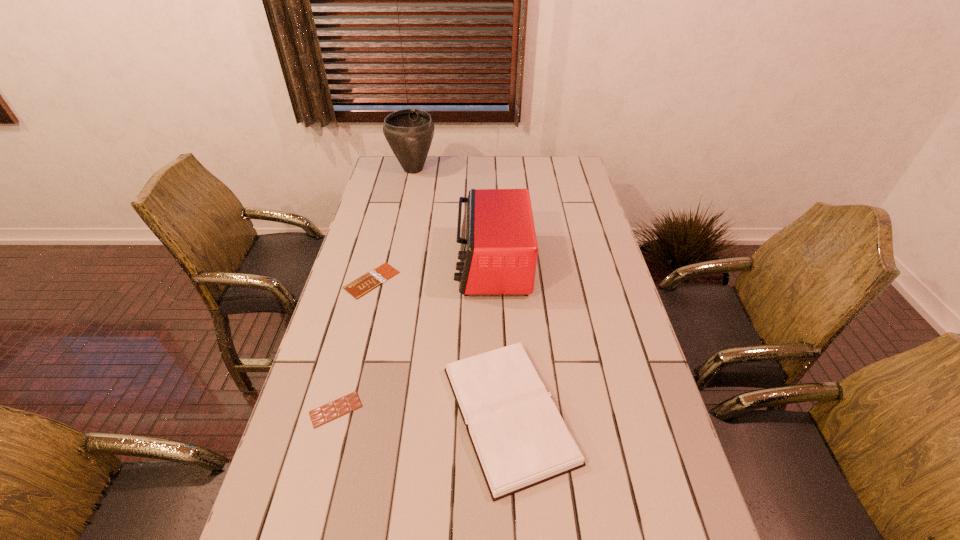
Identify the location of vacant space at the right edge of the desktop. (664, 475).

In the image, there is a desktop. Identify the location of vacant space at the far right corner. The height and width of the screenshot is (540, 960). (561, 178).

You are a GUI agent. You are given a task and a screenshot of the screen. Output one action in this format:
    pyautogui.click(x=<x>, y=<y>)
    Task: Click on the empty space between the taller chocolate bar and the third tallest object
    Image resolution: width=960 pixels, height=540 pixels.
    Given the screenshot: What is the action you would take?
    pyautogui.click(x=422, y=411)

You are a GUI agent. You are given a task and a screenshot of the screen. Output one action in this format:
    pyautogui.click(x=<x>, y=<y>)
    Task: Click on the free space between the taller chocolate bar and the hardback book
    
    Given the screenshot: What is the action you would take?
    (x=422, y=411)

Find the location of a particular element. This screenshot has height=540, width=960. free spot between the second shortest object and the fourth shortest object is located at coordinates (414, 337).

The image size is (960, 540). What are the coordinates of `blank region between the tallest object and the shortest object` in the screenshot? It's located at [x=393, y=225].

This screenshot has width=960, height=540. Identify the location of free point between the farther chocolate bar and the tallest object. (393, 225).

You are a GUI agent. You are given a task and a screenshot of the screen. Output one action in this format:
    pyautogui.click(x=<x>, y=<y>)
    Task: Click on the blank region between the hardback book and the shorter chocolate bar
    Image resolution: width=960 pixels, height=540 pixels.
    Given the screenshot: What is the action you would take?
    pyautogui.click(x=441, y=347)

You are a GUI agent. You are given a task and a screenshot of the screen. Output one action in this format:
    pyautogui.click(x=<x>, y=<y>)
    Task: Click on the vacant space that is in between the shorter chocolate bar and the toaster oven
    The width and height of the screenshot is (960, 540).
    Given the screenshot: What is the action you would take?
    pyautogui.click(x=432, y=273)

At what (x,y) coordinates should I click in order to perform the action: click on free spot between the nearer chocolate bar and the shorter chocolate bar. Please return your answer as a coordinate pair (x, y). This screenshot has height=540, width=960. Looking at the image, I should click on (354, 345).